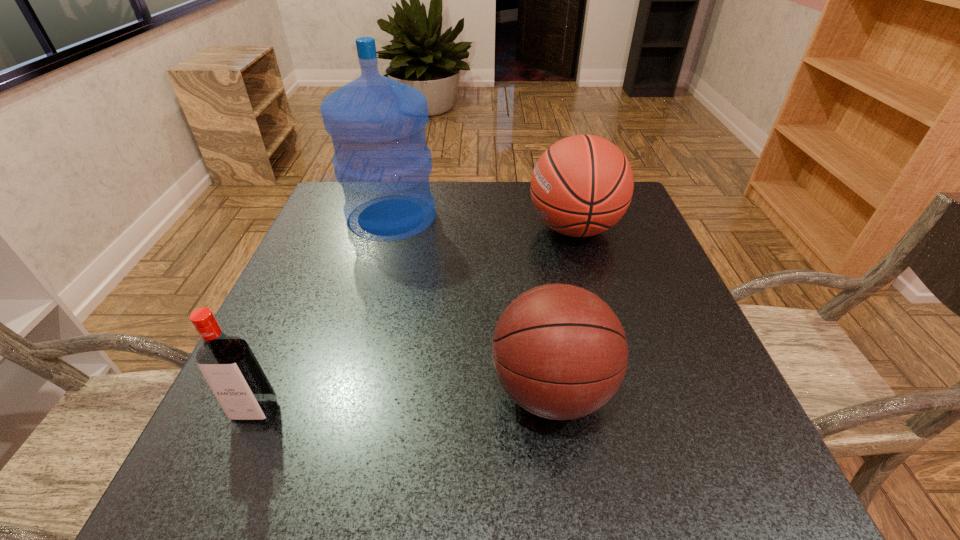
At what (x,y) coordinates should I click in order to perform the action: click on free space between the vodka and the nearer basketball. Please return your answer as a coordinate pair (x, y). Looking at the image, I should click on (403, 401).

The width and height of the screenshot is (960, 540). I want to click on vacant area that lies between the water jug and the nearer basketball, so click(x=471, y=303).

In order to click on object identified as the second closest to the nearer basketball in this screenshot , I will do `click(377, 125)`.

Locate which object ranks third in proximity to the tallest object. Please provide its 2D coordinates. Your answer should be formatted as a tuple, i.e. [(x, y)], where the tuple contains the x and y coordinates of a point satisfying the conditions above.

[(228, 364)]

Locate an element on the screen. The width and height of the screenshot is (960, 540). blank space that satisfies the following two spatial constraints: 1. on the front side of the nearer basketball; 2. on the right side of the water jug is located at coordinates (345, 390).

This screenshot has height=540, width=960. Identify the location of vacant space that satisfies the following two spatial constraints: 1. on the logo side of the farther basketball; 2. on the front and back of the vodka. (626, 412).